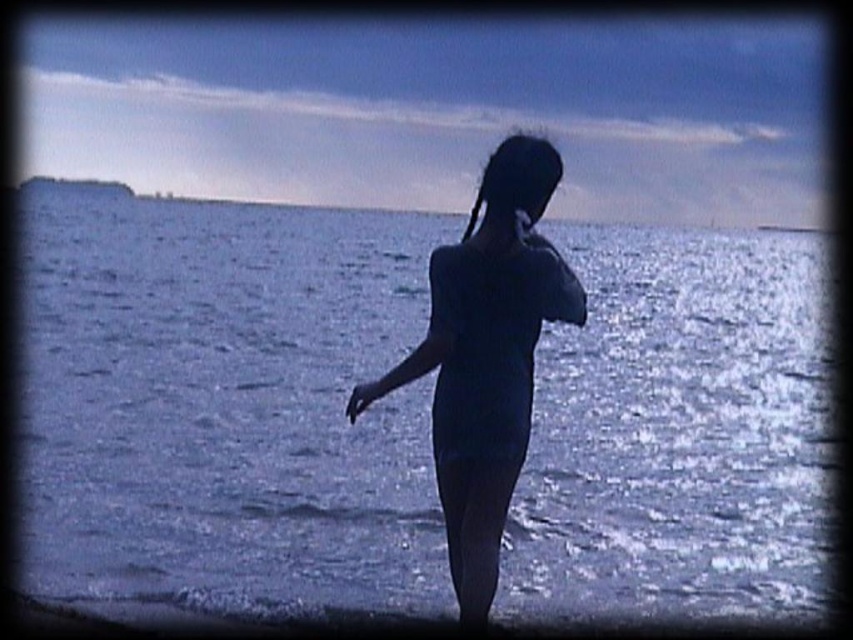
Question: Does blue water at center have a lesser width compared to matte blue swimsuit at center?

Choices:
 (A) no
 (B) yes

Answer: (A)

Question: Is blue water at center closer to camera compared to matte blue swimsuit at center?

Choices:
 (A) no
 (B) yes

Answer: (A)

Question: Among these objects, which one is nearest to the camera?

Choices:
 (A) matte blue swimsuit at center
 (B) blue water at center

Answer: (A)

Question: Is blue water at center thinner than matte blue swimsuit at center?

Choices:
 (A) no
 (B) yes

Answer: (A)